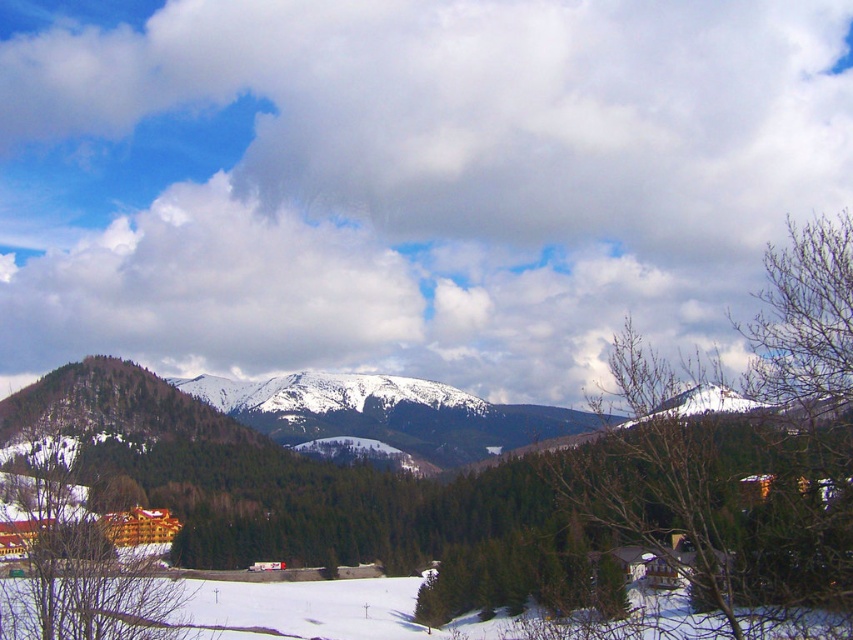
Can you confirm if white fluffy cloud at upper center is wider than green matte tree at lower left?

Correct, the width of white fluffy cloud at upper center exceeds that of green matte tree at lower left.

Is white fluffy cloud at upper center above green matte tree at lower left?

Yes, white fluffy cloud at upper center is above green matte tree at lower left.

Does point (209, 125) come farther from viewer compared to point (125, 540)?

Yes, point (209, 125) is behind point (125, 540).

Identify the location of white fluffy cloud at upper center. (405, 180).